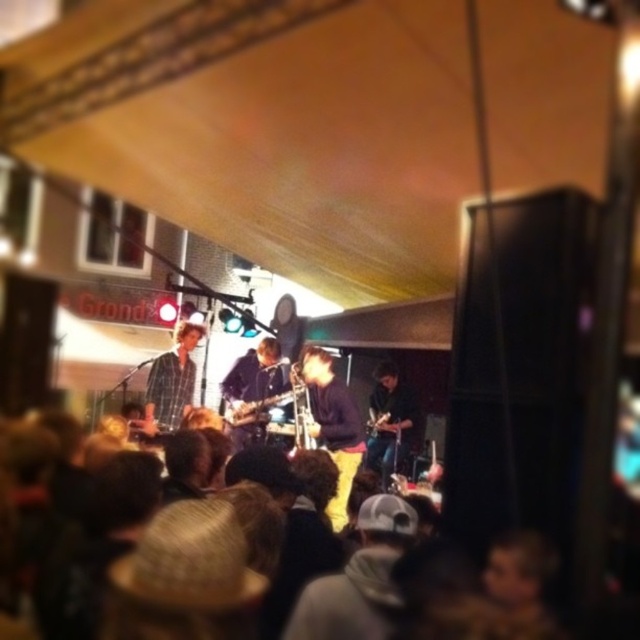
Question: Which object appears closest to the camera in this image?

Choices:
 (A) plaid shirt at center
 (B) matte yellow pants at center
 (C) wooden electric guitar at center

Answer: (B)

Question: Estimate the real-world distances between objects in this image. Which object is closer to the matte yellow pants at center?

Choices:
 (A) plaid shirt at center
 (B) dark blue jeans at lower center

Answer: (B)

Question: Where is plaid shirt at center located in relation to wooden electric guitar at center in the image?

Choices:
 (A) below
 (B) above

Answer: (B)

Question: Which object is positioned farthest from the wooden electric guitar at center?

Choices:
 (A) plaid shirt at center
 (B) matte yellow pants at center
 (C) dark blue jeans at lower center

Answer: (C)

Question: Is plaid shirt at center further to the viewer compared to wooden electric guitar at center?

Choices:
 (A) yes
 (B) no

Answer: (A)

Question: Does matte yellow pants at center appear on the left side of plaid shirt at center?

Choices:
 (A) yes
 (B) no

Answer: (B)